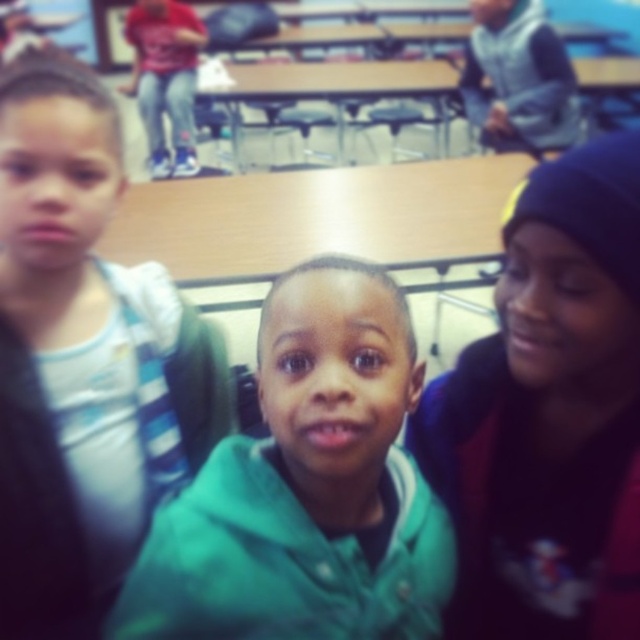
Between green fleece jacket at center and wooden table at center, which one has less height?

Standing shorter between the two is green fleece jacket at center.

Looking at this image, who is more forward, [317,317] or [307,65]?

Point [317,317] is more forward.

Locate an element on the screen. green fleece jacket at center is located at coordinates (307, 486).

This screenshot has width=640, height=640. Find the location of `green fleece jacket at center`. green fleece jacket at center is located at coordinates (307, 486).

Can you confirm if green matte hoodie at center is bigger than dark blue knit cap at upper right?

Indeed, green matte hoodie at center has a larger size compared to dark blue knit cap at upper right.

Image resolution: width=640 pixels, height=640 pixels. What do you see at coordinates (84, 360) in the screenshot? I see `green matte hoodie at center` at bounding box center [84, 360].

Does point (65, 513) come in front of point (426, 390)?

No, (65, 513) is further to viewer.

Locate an element on the screen. green matte hoodie at center is located at coordinates (84, 360).

Does green matte hoodie at center come in front of green fleece jacket at center?

No, it is not.

Who is higher up, green matte hoodie at center or green fleece jacket at center?

Positioned higher is green matte hoodie at center.

Is point (148, 340) behind point (420, 371)?

That is True.

This screenshot has width=640, height=640. Find the location of `green matte hoodie at center`. green matte hoodie at center is located at coordinates (84, 360).